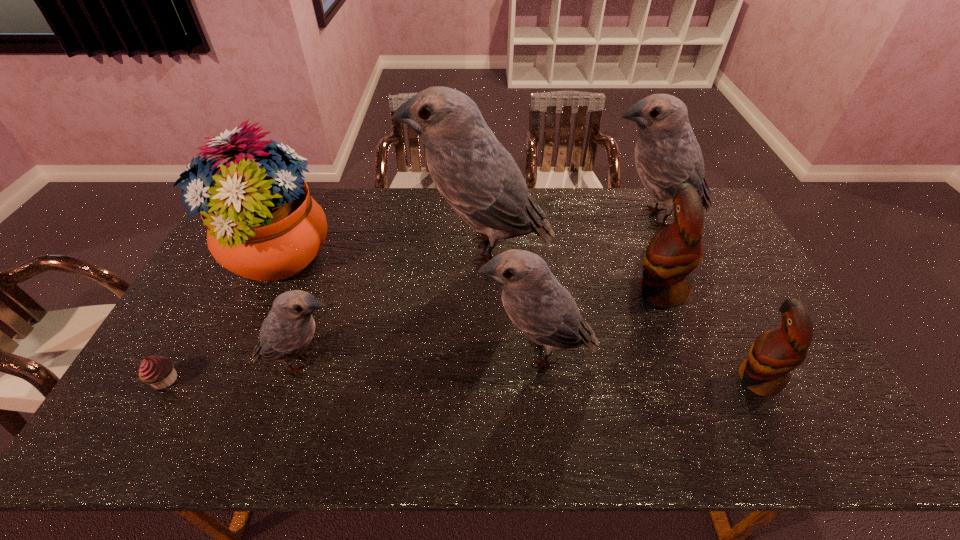
Find the location of a particular element. free space that is in between the tallest object and the bigger red parrot is located at coordinates (570, 271).

I want to click on free area in between the flower arrangement and the left red parrot, so click(468, 275).

Where is `vacant point located between the third biggest gray parrot and the leftmost gray parrot`? This screenshot has height=540, width=960. vacant point located between the third biggest gray parrot and the leftmost gray parrot is located at coordinates (420, 358).

At what (x,y) coordinates should I click in order to perform the action: click on the fifth closest object relative to the third biggest gray parrot. Please return your answer as a coordinate pair (x, y). This screenshot has height=540, width=960. Looking at the image, I should click on (667, 154).

This screenshot has height=540, width=960. I want to click on object that can be found as the third closest to the flower arrangement, so click(x=475, y=174).

Locate an element on the screen. the third closest parrot relative to the pink cupcake is located at coordinates pos(538,305).

Locate which parrot ranks fifth in proximity to the cupcake. Please provide its 2D coordinates. Your answer should be formatted as a tuple, i.e. [(x, y)], where the tuple contains the x and y coordinates of a point satisfying the conditions above.

[(667, 154)]

This screenshot has height=540, width=960. Identify the location of gray parrot identified as the third closest to the leftmost gray parrot. (667, 154).

Locate which gray parrot is the second closest to the right red parrot. Please provide its 2D coordinates. Your answer should be formatted as a tuple, i.e. [(x, y)], where the tuple contains the x and y coordinates of a point satisfying the conditions above.

[(667, 154)]

The image size is (960, 540). What are the coordinates of `vacant space that satisfies the following two spatial constraints: 1. on the front-facing side of the tallest object; 2. on the front side of the cupcake` in the screenshot? It's located at (481, 380).